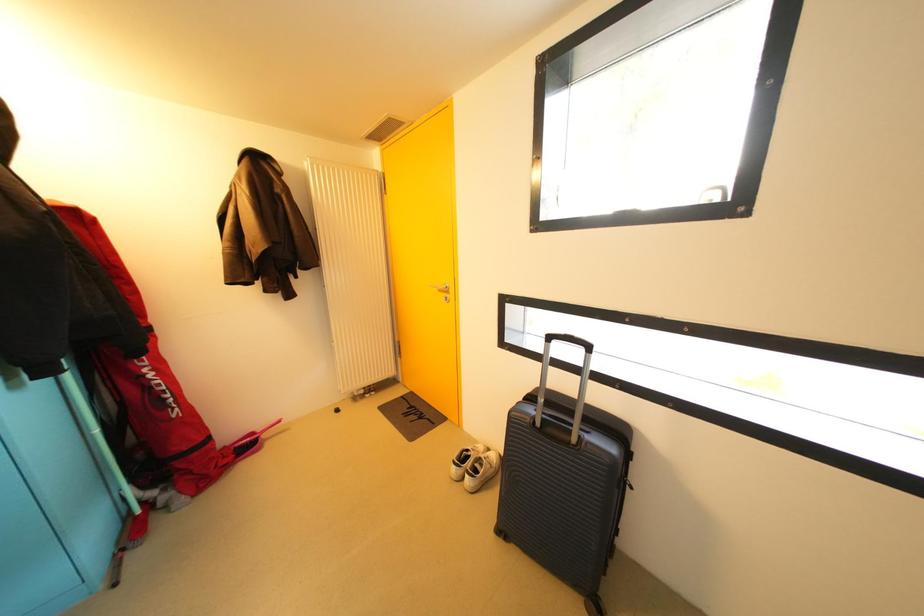
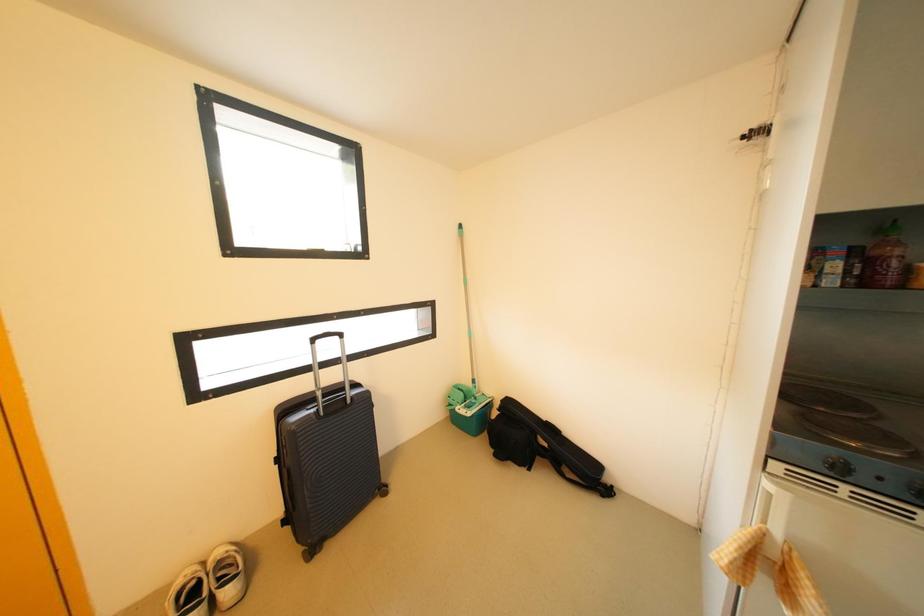
Question: How did the camera likely rotate?

Choices:
 (A) Left
 (B) Right
 (C) Up
 (D) Down

Answer: (B)